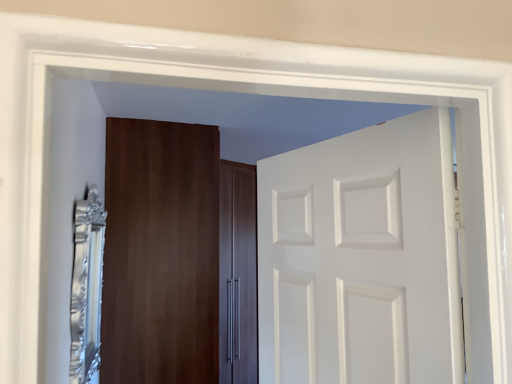
Question: Considering the positions of silver metallic mirror at left and white matte door at center, the second door viewed from the back, in the image, is silver metallic mirror at left bigger or smaller than white matte door at center, the second door viewed from the back,?

Choices:
 (A) small
 (B) big

Answer: (A)

Question: From the image's perspective, relative to white matte door at center, which appears as the first door when viewed from the right, is silver metallic mirror at left above or below?

Choices:
 (A) above
 (B) below

Answer: (B)

Question: Estimate the real-world distances between objects in this image. Which object is farther from the silver metallic mirror at left?

Choices:
 (A) matte wood cabinet at center, arranged as the 2th door when viewed from the front
 (B) white matte door at center, which ranks as the 2th door in left-to-right order

Answer: (B)

Question: Which of these objects is positioned farthest from the matte wood cabinet at center, which ranks as the 1th door in left-to-right order?

Choices:
 (A) white matte door at center, which is the 1th door in front-to-back order
 (B) silver metallic mirror at left

Answer: (A)